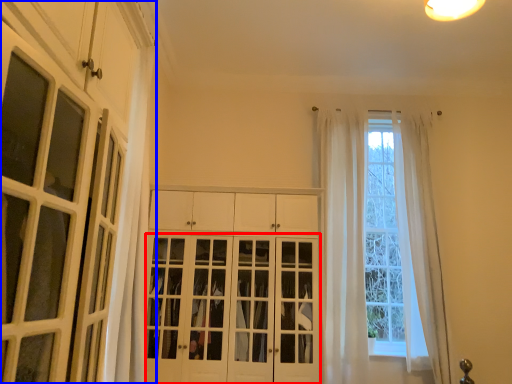
Question: Which point is further to the camera, door (highlighted by a red box) or cabinetry (highlighted by a blue box)?

Choices:
 (A) door
 (B) cabinetry

Answer: (A)